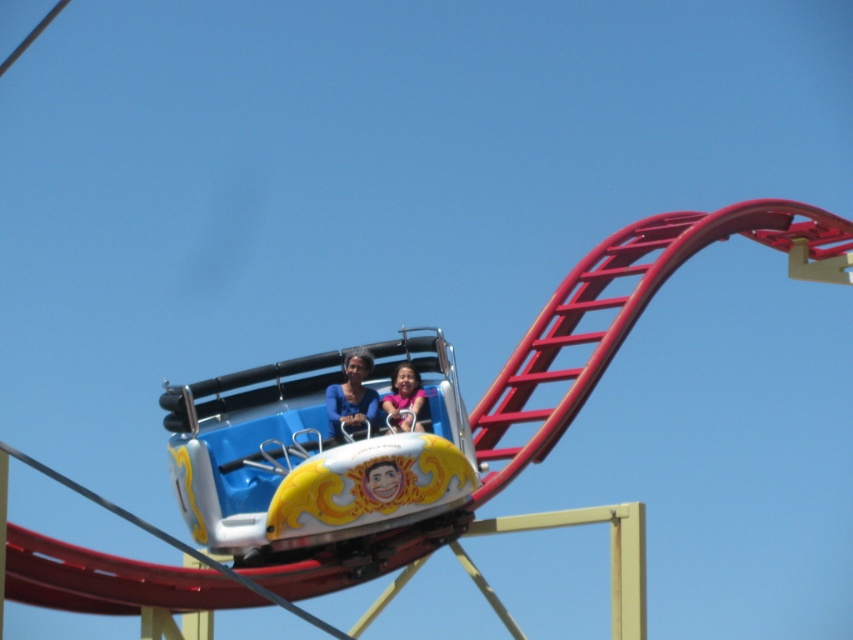
You are designing a safety inspection route for the amusement park. The roller coaster car must be inspected at its highest point. Given that the highest point on the track is at coordinates point A, which is at position 0.713, 0.366, is the metallic blue roller coaster car at center currently at the highest point?

Yes, the metallic blue roller coaster car at center is located at point A, which is the highest point on the track, so it is currently at the highest point.

You are a safety inspector checking the amusement park. You notice the metallic blue roller coaster car at center and the matte pink shirt at center. Based on their sizes, which one is more likely to require a larger safety harness?

The metallic blue roller coaster car at center has a larger size compared to the matte pink shirt at center, so it would require a larger safety harness.